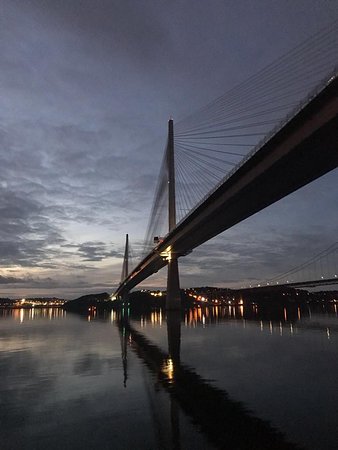
At what (x,y) coordinates should I click in order to perform the action: click on lights. Please return your answer as a coordinate pair (x, y). The height and width of the screenshot is (450, 338). Looking at the image, I should click on (45, 305), (208, 300), (198, 298), (196, 297), (169, 255).